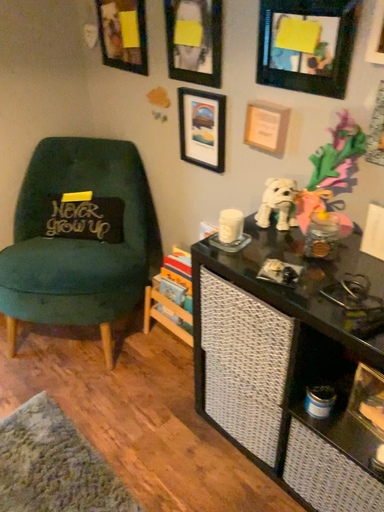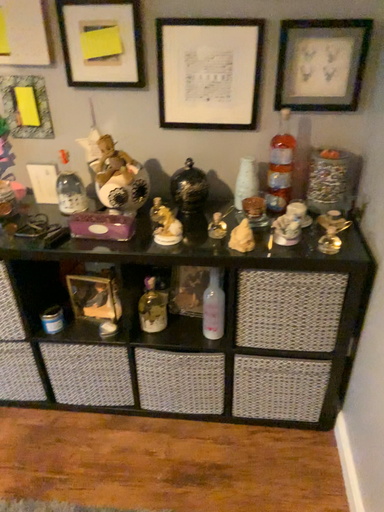
Question: Which way did the camera rotate in the video?

Choices:
 (A) rotated left
 (B) rotated right

Answer: (B)